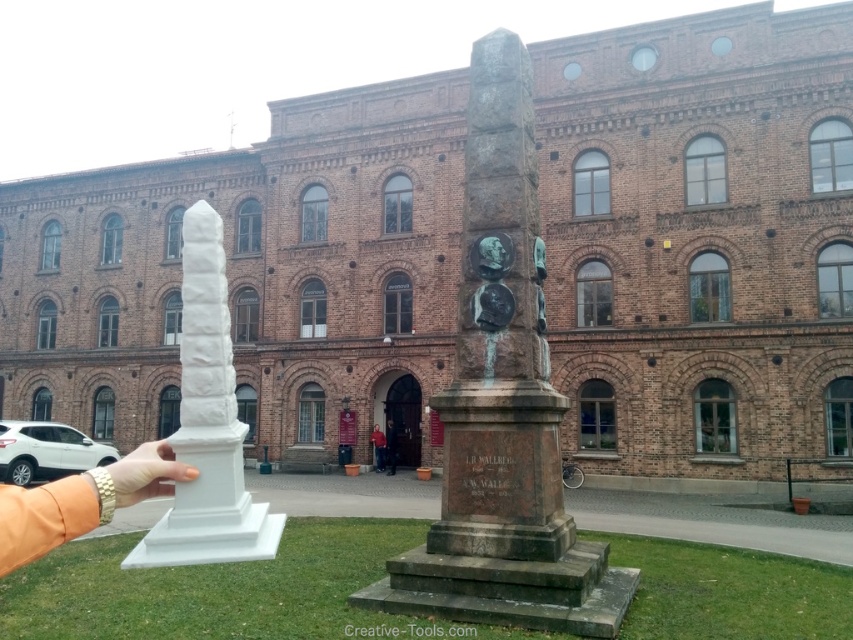
Between point (201, 374) and point (194, 472), which one is positioned behind?

The point (201, 374) is behind.

Is white marble obelisk at center to the right of white matte hand at lower left from the viewer's perspective?

Yes, white marble obelisk at center is to the right of white matte hand at lower left.

Between point (198, 240) and point (132, 476), which one is positioned behind?

Point (198, 240)

Find the location of a particular element. The width and height of the screenshot is (853, 640). white marble obelisk at center is located at coordinates (207, 424).

Identify the location of bronze/stone column at center. Image resolution: width=853 pixels, height=640 pixels. (503, 404).

Can you confirm if bronze/stone column at center is taller than dark blue jeans at center?

Indeed, bronze/stone column at center has a greater height compared to dark blue jeans at center.

Describe the element at coordinates (503, 404) in the screenshot. I see `bronze/stone column at center` at that location.

Locate an element on the screen. This screenshot has width=853, height=640. bronze/stone column at center is located at coordinates (503, 404).

Is point (467, 385) closer to camera compared to point (279, 522)?

No, it is behind (279, 522).

I want to click on bronze/stone column at center, so click(x=503, y=404).